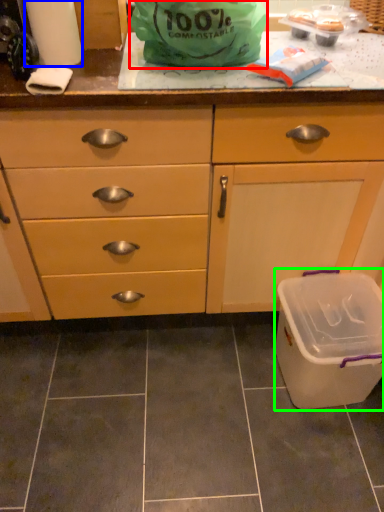
Question: Estimate the real-world distances between objects in this image. Which object is farther from plastic bag (highlighted by a red box), paper towel (highlighted by a blue box) or recycling bin (highlighted by a green box)?

Choices:
 (A) paper towel
 (B) recycling bin

Answer: (B)